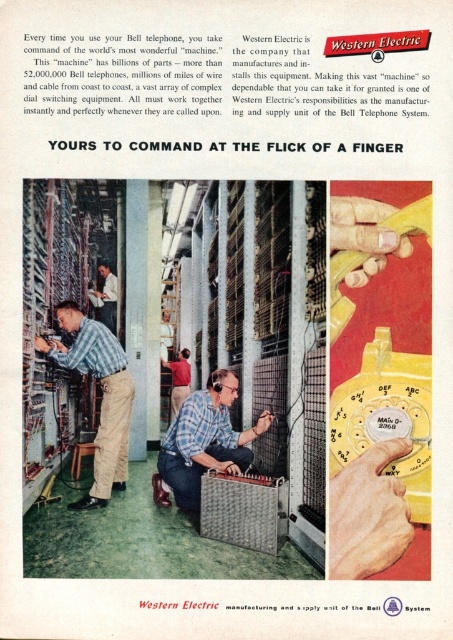
In the vintage Western Electric advertisement, there are two workers wearing a matte blue shirt at center and a red shirt at center. From the perspective of someone standing in front of the ad, which worker is positioned to the left?

The matte blue shirt at center is to the left of the red shirt at center.

In the vintage Western Electric advertisement, there is a person wearing a matte blue shirt at center. Where exactly is this person positioned in the image?

The matte blue shirt at center is located at the 2D coordinates point (101, 396) in the image.